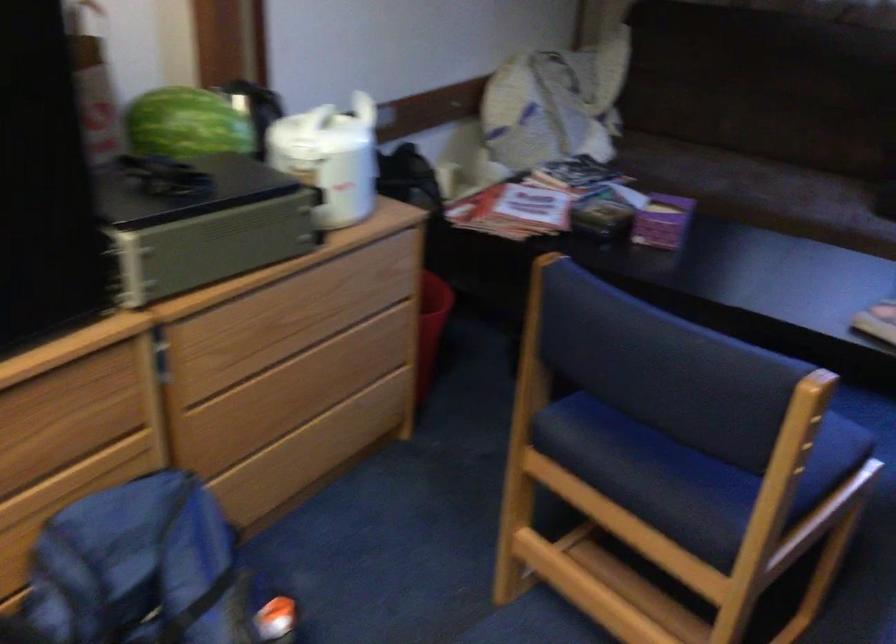
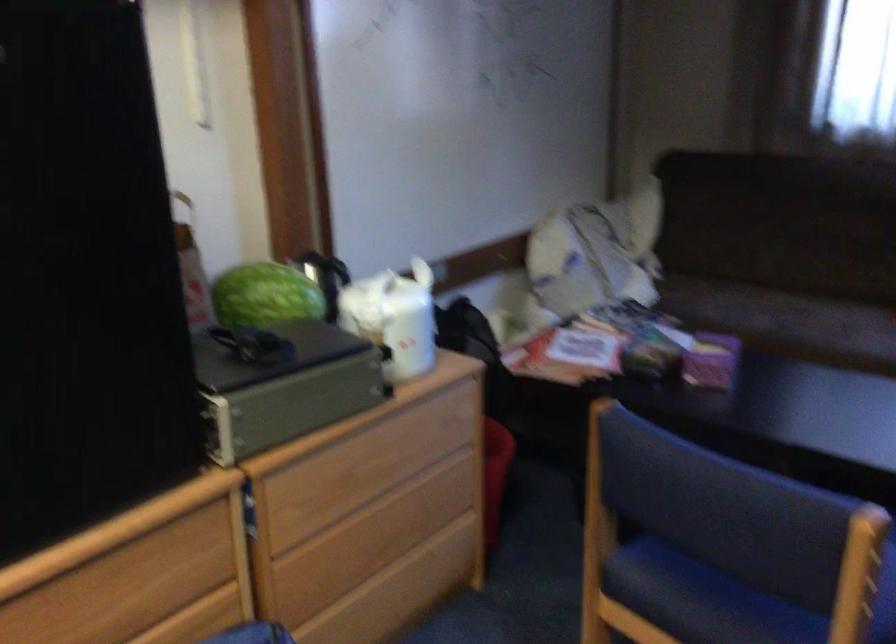
Find the pixel in the second image that matches point 631,459 in the first image.

(702, 599)